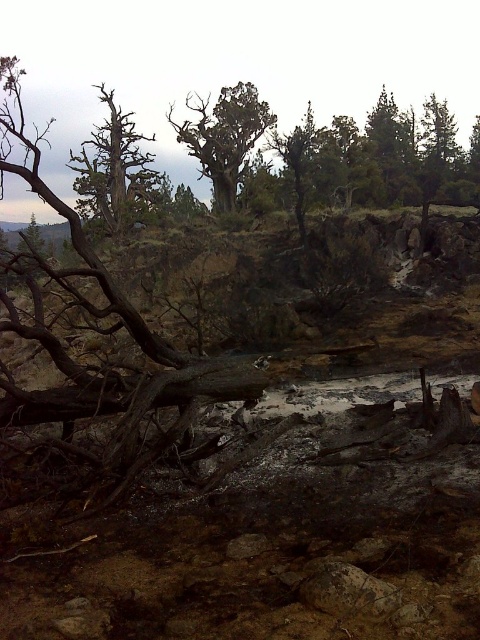
Does dead wood at left have a smaller size compared to green textured tree at upper center?

No, dead wood at left is not smaller than green textured tree at upper center.

Which is in front, point (99, 154) or point (300, 216)?

Positioned in front is point (300, 216).

Find the location of `dead wood at left`. dead wood at left is located at coordinates (x=113, y=170).

Does dark brown wood at left have a greater width compared to green textured tree at upper center?

Correct, the width of dark brown wood at left exceeds that of green textured tree at upper center.

Is point (85, 273) in front of point (276, 150)?

That is True.

At what (x,y) coordinates should I click in order to perform the action: click on dark brown wood at left. Please return your answer as a coordinate pair (x, y). This screenshot has width=480, height=640. Looking at the image, I should click on (103, 333).

Does point (78, 161) come behind point (238, 164)?

Yes.

Does point (106, 193) come farther from viewer compared to point (223, 109)?

No.

This screenshot has width=480, height=640. I want to click on dead wood at left, so click(113, 170).